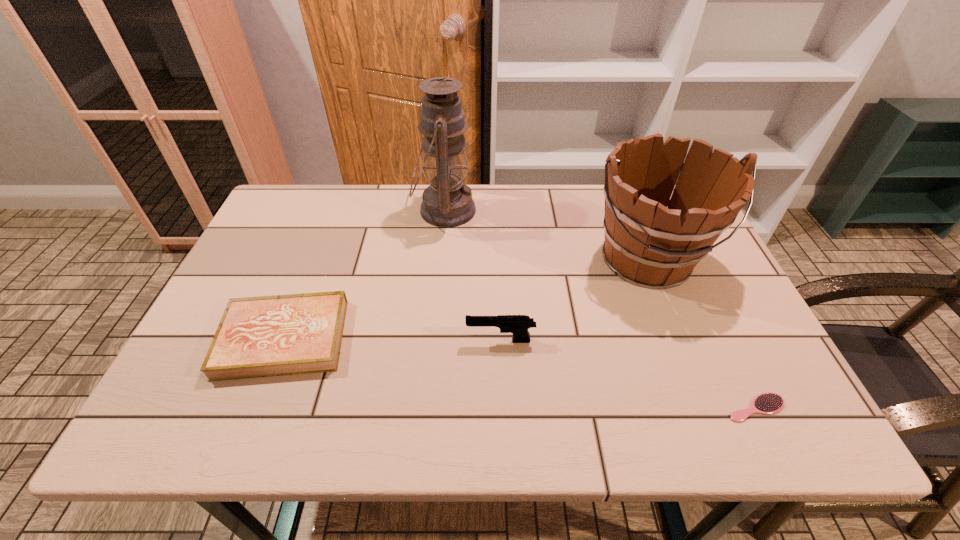
At what (x,y) coordinates should I click in order to perform the action: click on free space that satisfies the following two spatial constraints: 1. on the front-facing side of the third tallest object; 2. on the left side of the shortest object. Please return your answer as a coordinate pair (x, y). Looking at the image, I should click on (503, 408).

Identify the location of free space that satisfies the following two spatial constraints: 1. with the handle on the wine bucket; 2. on the front-facing side of the pistol. (678, 341).

Identify the location of vacant position in the image that satisfies the following two spatial constraints: 1. with the handle on the wine bucket; 2. on the left side of the hairbrush. The width and height of the screenshot is (960, 540). (704, 408).

Identify the location of free location that satisfies the following two spatial constraints: 1. on the back side of the shortest object; 2. on the front-facing side of the third shortest object. (724, 341).

I want to click on vacant space that satisfies the following two spatial constraints: 1. on the front side of the shortest object; 2. on the left side of the leftmost object, so click(x=256, y=408).

Identify the location of free region that satisfies the following two spatial constraints: 1. with the handle on the fourth shortest object; 2. on the front-facing side of the pistol. The width and height of the screenshot is (960, 540). (678, 341).